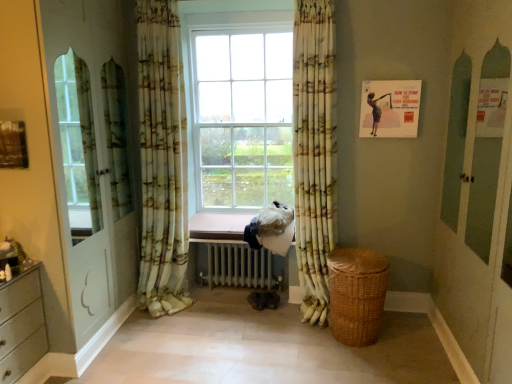
The image size is (512, 384). Identify the location of vacant space to the right of woven brown basket at lower right. (410, 338).